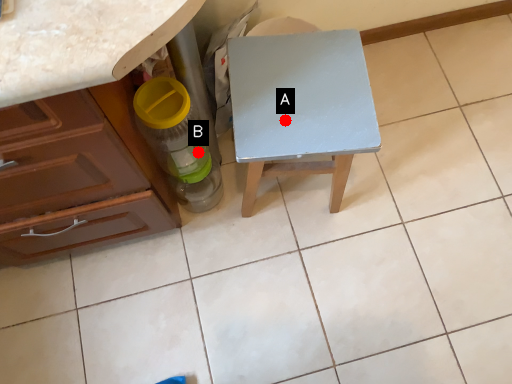
Question: Two points are circled on the image, labeled by A and B beside each circle. Which point is closer to the camera?

Choices:
 (A) A is closer
 (B) B is closer

Answer: (A)